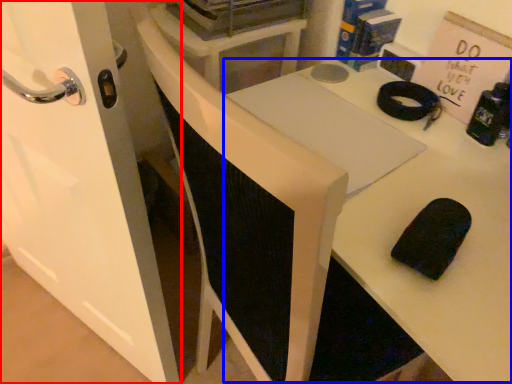
Question: Which of the following is the closest to the observer, door (highlighted by a red box) or table (highlighted by a blue box)?

Choices:
 (A) door
 (B) table

Answer: (B)